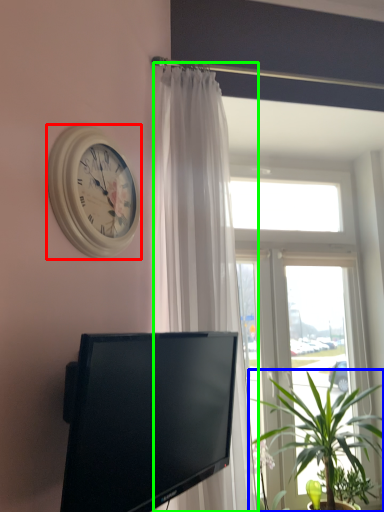
Question: Which is farther away from wall clock (highlighted by a red box)? houseplant (highlighted by a blue box) or curtain (highlighted by a green box)?

Choices:
 (A) houseplant
 (B) curtain

Answer: (A)